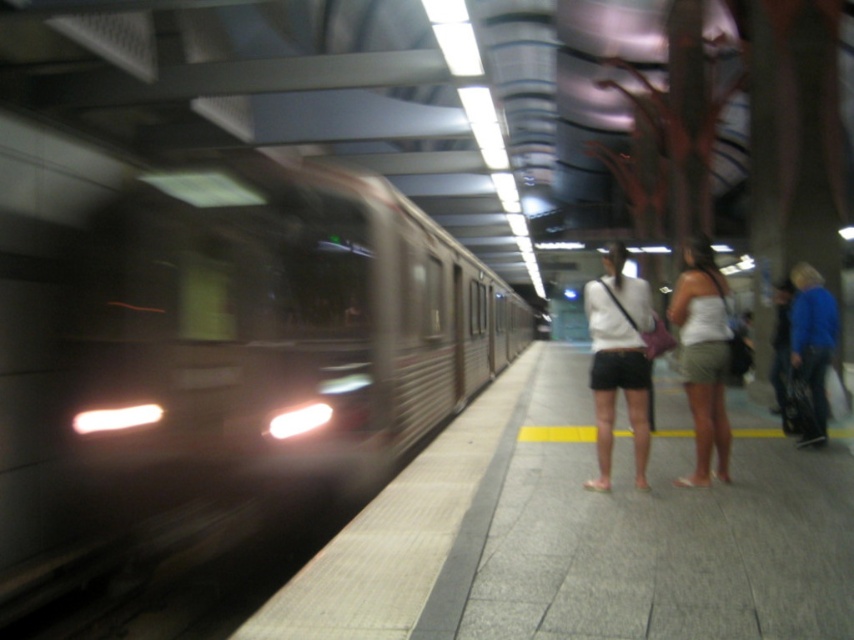
You are a passenger standing on the gray concrete platform at center and want to reach the white matte shorts at center. Which direction should you move to get closer?

The gray concrete platform at center is closer to the viewer than the white matte shorts at center, so you should move towards the viewer to get closer to the white matte shorts at center.

You are standing on the gray concrete platform at center and see the blue denim jeans at right. Which object is closer to the ground?

The gray concrete platform at center is positioned under blue denim jeans at right, so the gray concrete platform at center is closer to the ground.

You are a photographer taking a picture of the subway station. You notice two people wearing white matte shorts at center and white cotton tank top at center. Which clothing item is positioned closer to the camera?

The white matte shorts at center is closer to the viewer than the white cotton tank top at center, so the white matte shorts at center would appear closer in the photo.